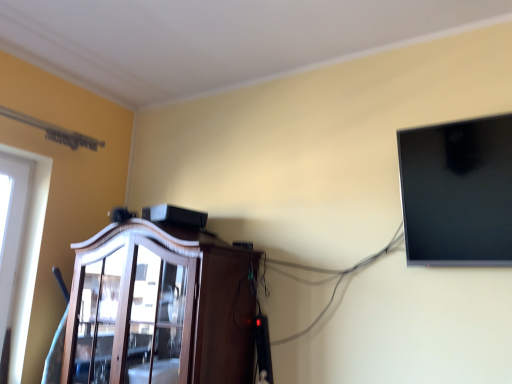
Question: In the image, is matte black monitor at upper right positioned in front of or behind dark wood cabinet at center?

Choices:
 (A) behind
 (B) front

Answer: (B)

Question: From the image's perspective, is matte black monitor at upper right positioned above or below dark wood cabinet at center?

Choices:
 (A) above
 (B) below

Answer: (A)

Question: Considering the positions of matte black monitor at upper right and dark wood cabinet at center in the image, is matte black monitor at upper right wider or thinner than dark wood cabinet at center?

Choices:
 (A) wide
 (B) thin

Answer: (B)

Question: Relative to matte black monitor at upper right, is dark wood cabinet at center in front or behind?

Choices:
 (A) front
 (B) behind

Answer: (B)

Question: From the image's perspective, is dark wood cabinet at center positioned above or below matte black monitor at upper right?

Choices:
 (A) above
 (B) below

Answer: (B)

Question: From their relative heights in the image, would you say dark wood cabinet at center is taller or shorter than matte black monitor at upper right?

Choices:
 (A) short
 (B) tall

Answer: (B)

Question: Is dark wood cabinet at center wider or thinner than matte black monitor at upper right?

Choices:
 (A) wide
 (B) thin

Answer: (A)